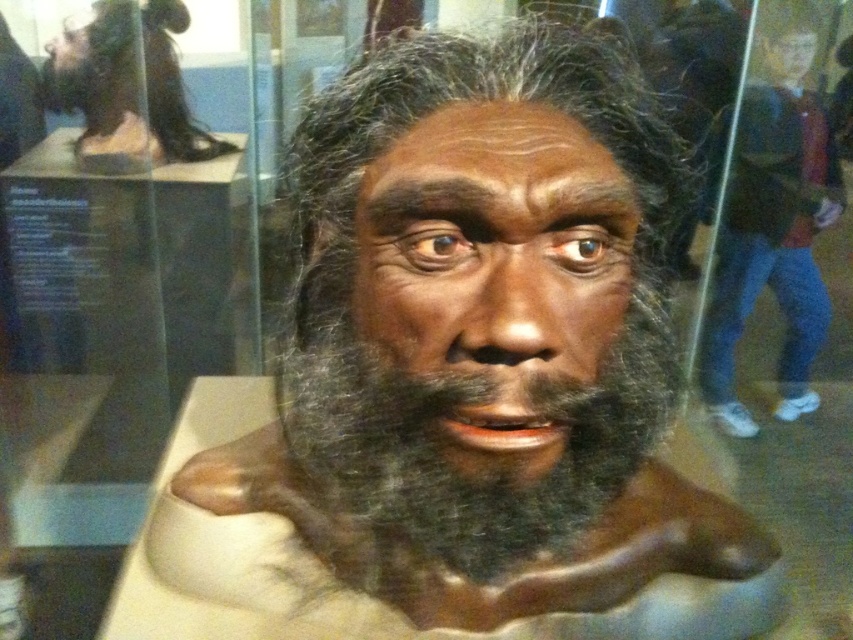
Consider the image. You are a tour guide in a museum and want to point out the Neanderthal bust to your visitors. You are standing 2 meters away from the glass enclosure. The point you need to indicate is at point (482, 476). Can you reach that point with your laser pointer if its maximum range is 2.5 meters?

The distance between point (482, 476) and the camera is 41.71 centimeters. Since you are 2 meters away from the glass enclosure, the total distance to the point would be approximately 2 meters plus 0.4171 meters, totaling 2.4171 meters. This is within the laser pointer maximum range of 2.5 meters, so yes, you can reach it.

You are a museum visitor observing the Neanderthal bust. You notice the matte brown face at center and the brown matte hair at upper left. Which object is positioned higher in the image?

The brown matte hair at upper left is positioned higher than the matte brown face at center.